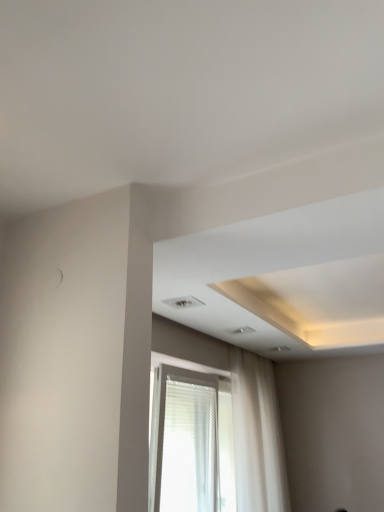
Question: Is white sheer curtain at lower center inside or outside of white sheer curtain at center?

Choices:
 (A) inside
 (B) outside

Answer: (B)

Question: In terms of size, does white sheer curtain at lower center appear bigger or smaller than white sheer curtain at center?

Choices:
 (A) small
 (B) big

Answer: (B)

Question: From the image's perspective, is white sheer curtain at lower center above or below white sheer curtain at center?

Choices:
 (A) above
 (B) below

Answer: (A)

Question: From their relative heights in the image, would you say white sheer curtain at center is taller or shorter than white sheer curtain at lower center?

Choices:
 (A) short
 (B) tall

Answer: (B)

Question: From the image's perspective, relative to white sheer curtain at lower center, is white sheer curtain at center above or below?

Choices:
 (A) above
 (B) below

Answer: (B)

Question: Is white sheer curtain at center to the left or to the right of white sheer curtain at lower center in the image?

Choices:
 (A) right
 (B) left

Answer: (A)

Question: Considering the positions of point (261, 428) and point (162, 382), is point (261, 428) closer or farther from the camera than point (162, 382)?

Choices:
 (A) farther
 (B) closer

Answer: (A)